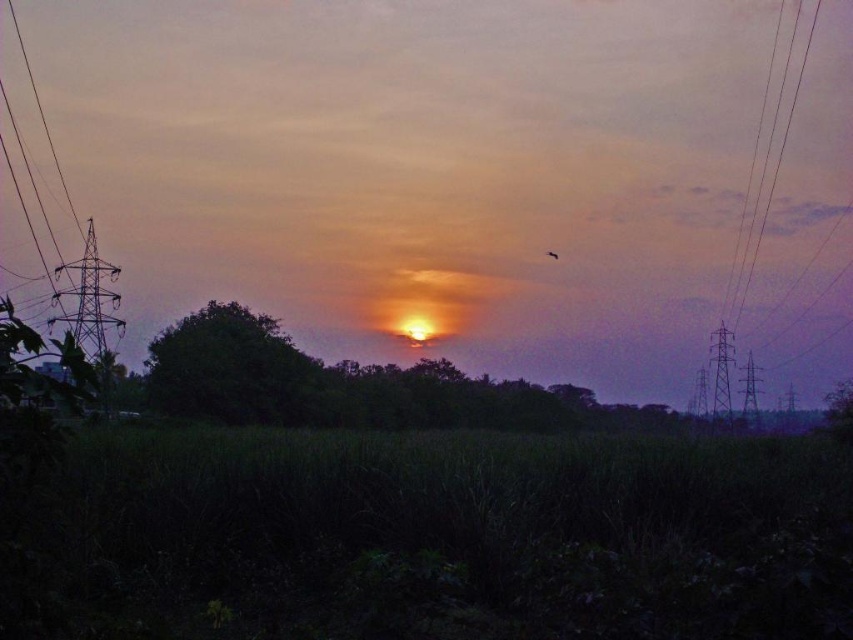
Which is behind, point (195, 397) or point (554, 259)?

Point (554, 259)

Is green leafy tree at center to the left of orange matte bird at center from the viewer's perspective?

Indeed, green leafy tree at center is positioned on the left side of orange matte bird at center.

Describe the element at coordinates (231, 369) in the screenshot. The image size is (853, 640). I see `green leafy tree at center` at that location.

Find the location of `green leafy tree at center`. green leafy tree at center is located at coordinates (231, 369).

Can you confirm if metallic wire at right is smaller than orange matte bird at center?

Incorrect, metallic wire at right is not smaller in size than orange matte bird at center.

Between point (775, 38) and point (548, 257), which one is positioned in front?

Positioned in front is point (548, 257).

Where is `metallic wire at right`? The height and width of the screenshot is (640, 853). metallic wire at right is located at coordinates (757, 196).

Does green leafy tree at center have a lesser height compared to metallic wire at right?

Yes, green leafy tree at center is shorter than metallic wire at right.

Does point (282, 364) come behind point (715, 342)?

No, it is in front of (715, 342).

Which is in front, point (206, 308) or point (734, 362)?

Point (206, 308) is more forward.

Locate an element on the screen. green leafy tree at center is located at coordinates (231, 369).